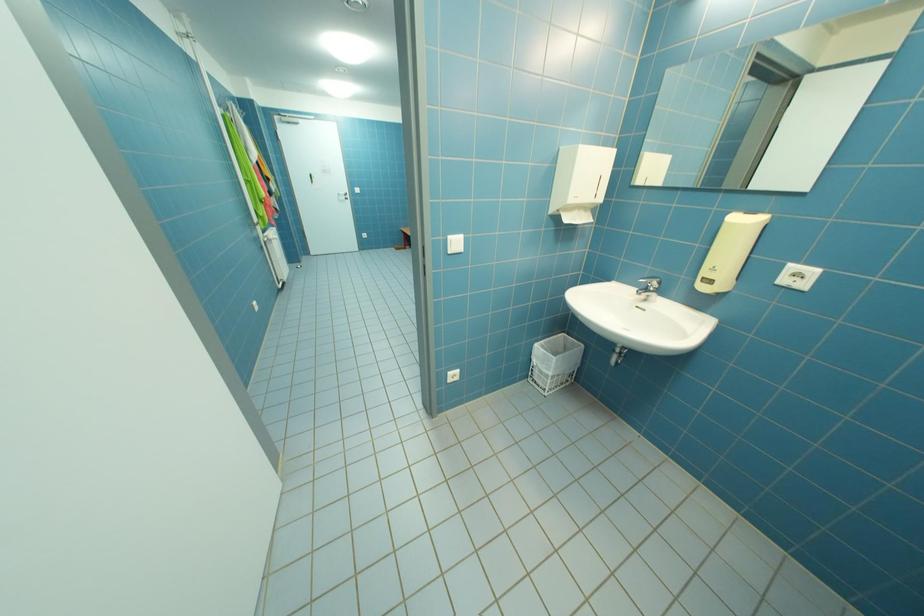
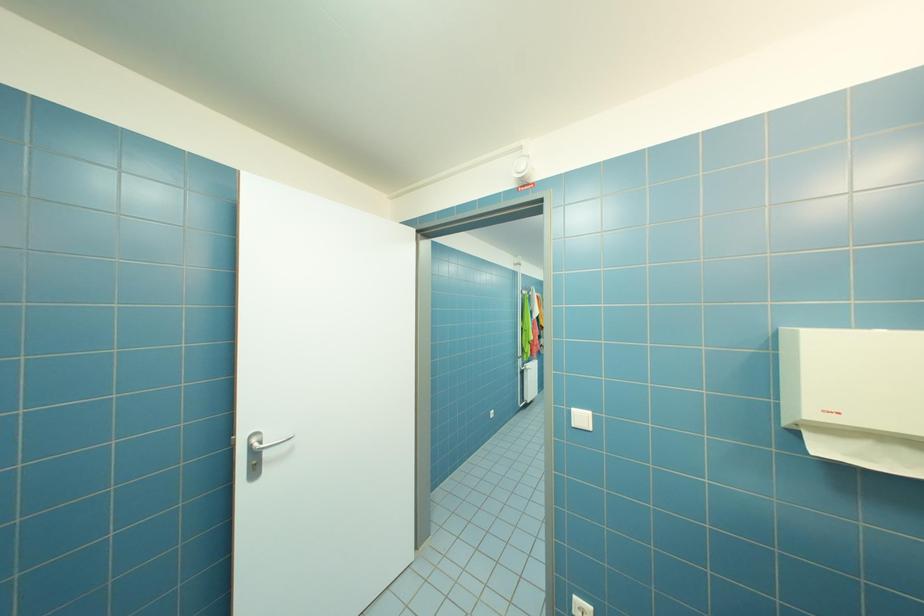
How did the camera likely rotate?

The rotation direction of the camera is left-up.